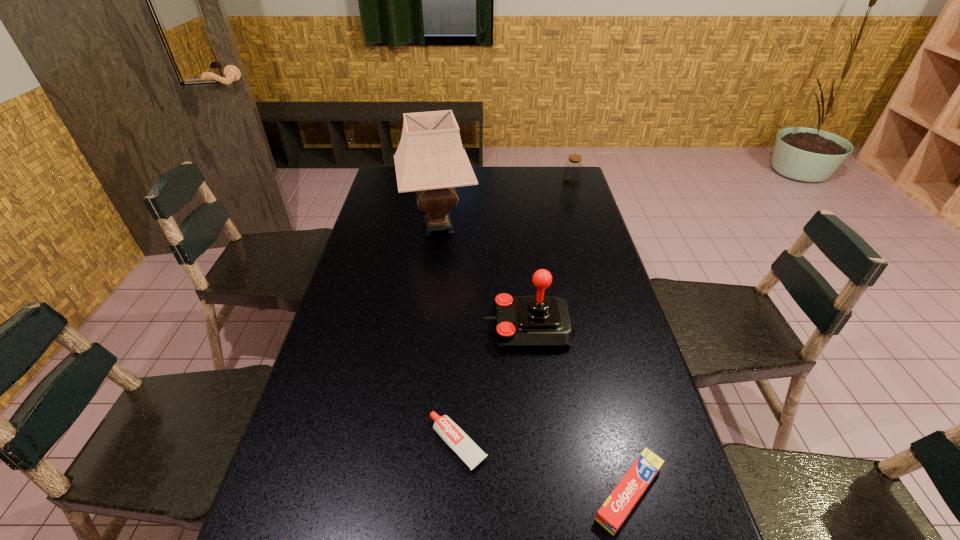
At what (x,y) coordinates should I click in order to perform the action: click on the fifth nearest object. Please return your answer as a coordinate pair (x, y). This screenshot has width=960, height=540. Looking at the image, I should click on (430, 160).

Find the location of `lampshade`. lampshade is located at coordinates (430, 160).

The width and height of the screenshot is (960, 540). What are the coordinates of `joystick` in the screenshot? It's located at (526, 322).

Locate an element on the screen. This screenshot has height=540, width=960. the third farthest object is located at coordinates (526, 322).

Find the location of a particular element. The height and width of the screenshot is (540, 960). jar is located at coordinates (573, 168).

This screenshot has width=960, height=540. I want to click on the third tallest object, so click(x=573, y=168).

The height and width of the screenshot is (540, 960). In order to click on the left toothpaste in this screenshot , I will do `click(450, 432)`.

Where is `the right toothpaste`? Image resolution: width=960 pixels, height=540 pixels. the right toothpaste is located at coordinates (614, 511).

The height and width of the screenshot is (540, 960). I want to click on vacant space located on the right of the lampshade, so click(x=564, y=226).

In order to click on free space located 0.060m on the base of the joystick in this screenshot , I will do `click(463, 328)`.